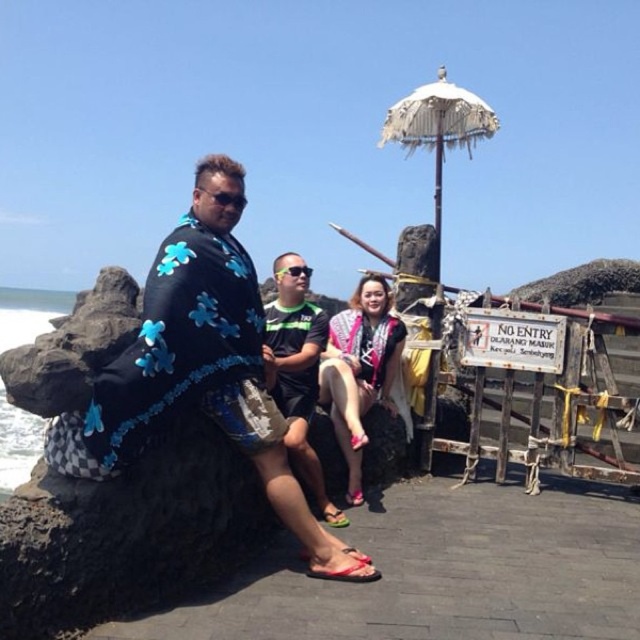
Question: Can you confirm if black fabric with blue flowers at center is positioned above patterned fabric dress at center?

Choices:
 (A) no
 (B) yes

Answer: (A)

Question: Is black fabric with blue flowers at center smaller than patterned fabric dress at center?

Choices:
 (A) yes
 (B) no

Answer: (A)

Question: Which of the following is the farthest from the observer?

Choices:
 (A) (156, 394)
 (B) (369, 380)

Answer: (B)

Question: Can you confirm if black fabric with blue flowers at center is positioned below patterned fabric dress at center?

Choices:
 (A) yes
 (B) no

Answer: (A)

Question: Which of the following is the farthest from the observer?

Choices:
 (A) black fabric with blue flowers at center
 (B) patterned fabric dress at center
 (C) black fabric shirt at center

Answer: (B)

Question: Among these objects, which one is nearest to the camera?

Choices:
 (A) black fabric with blue flowers at center
 (B) patterned fabric dress at center

Answer: (A)